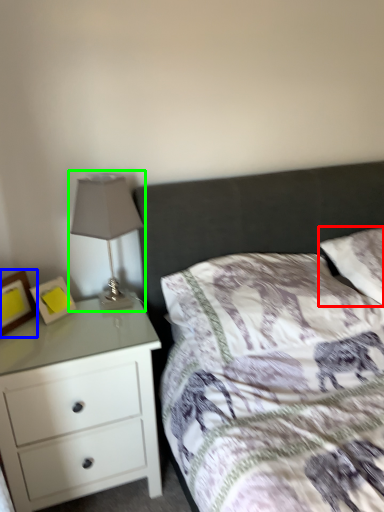
Question: Which object is the farthest from pillow (highlighted by a red box)? Choose among these: picture frame (highlighted by a blue box) or table lamp (highlighted by a green box).

Choices:
 (A) picture frame
 (B) table lamp

Answer: (A)